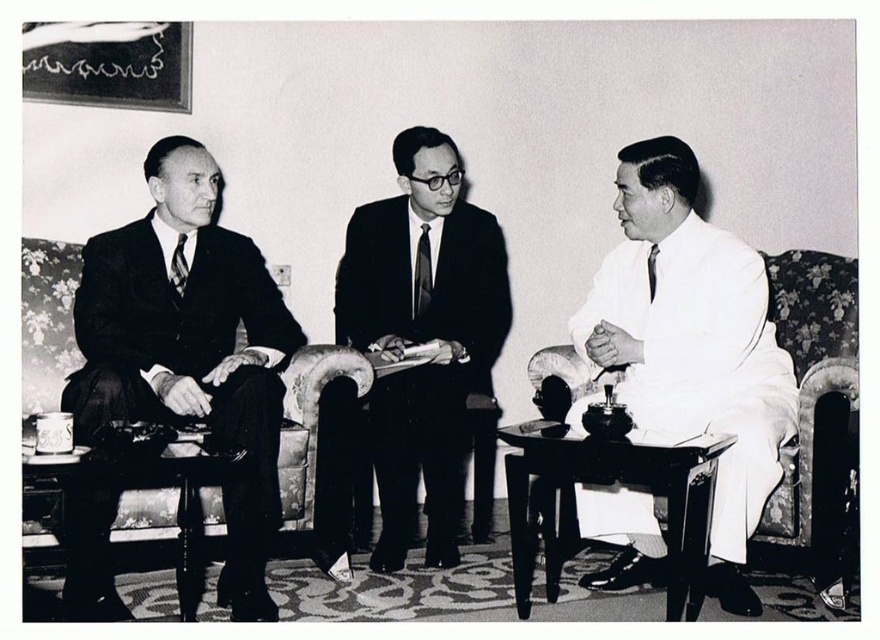
Can you confirm if wooden polished table at lower left is smaller than silky black tie at center?

No.

The height and width of the screenshot is (640, 880). What do you see at coordinates (178, 506) in the screenshot? I see `wooden polished table at lower left` at bounding box center [178, 506].

Where is `wooden polished table at lower left`? The height and width of the screenshot is (640, 880). wooden polished table at lower left is located at coordinates (178, 506).

Does point (682, 497) lie in front of point (651, 268)?

Yes, it is in front of point (651, 268).

Does wooden table at center come behind black silk tie at right?

No, wooden table at center is closer to the viewer.

Which is behind, point (560, 467) or point (650, 282)?

The point (650, 282) is more distant.

What are the coordinates of `wooden table at center` in the screenshot? It's located at (610, 484).

Which is more to the right, wooden table at center or silky black tie at center?

From the viewer's perspective, wooden table at center appears more on the right side.

Between point (722, 440) and point (426, 282), which one is positioned in front?

Point (722, 440) is in front.

The image size is (880, 640). In order to click on wooden table at center in this screenshot , I will do `click(610, 484)`.